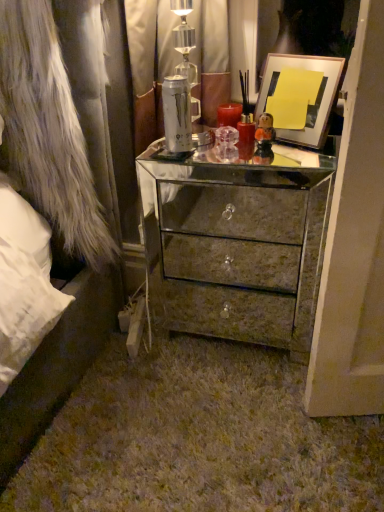
I want to click on free spot below mirrored metallic chest of drawers at center (from a real-world perspective), so click(x=233, y=339).